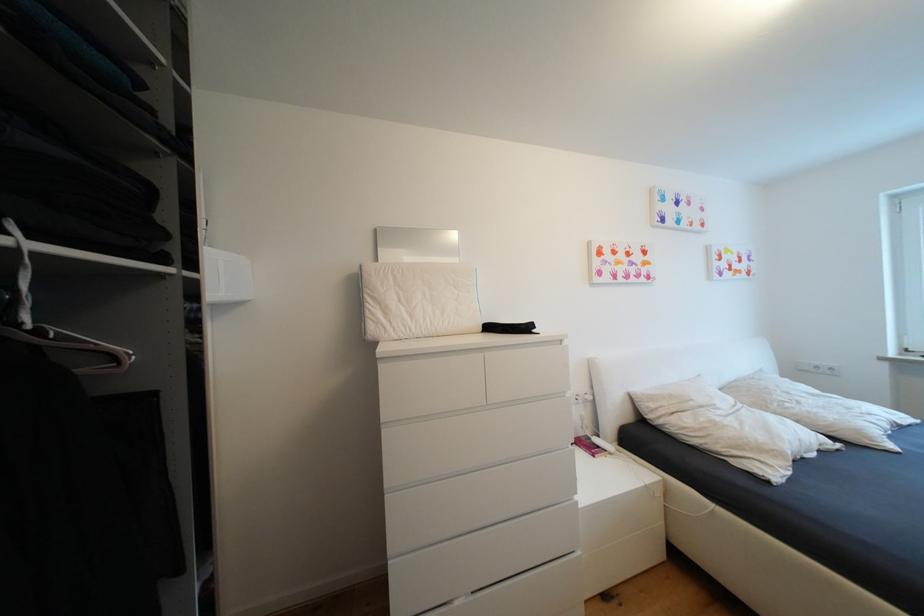
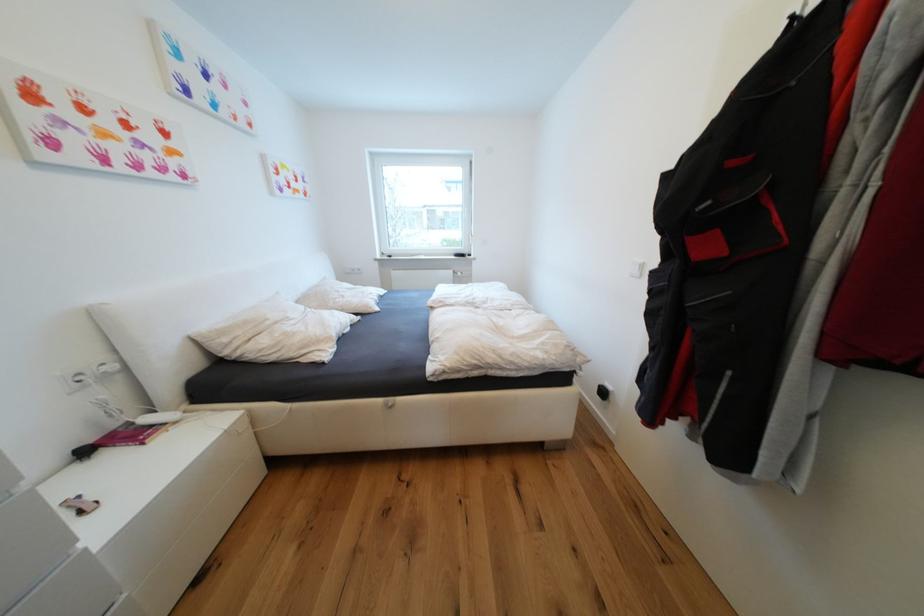
First-person continuous shooting, in which direction is the camera rotating?

The camera's rotation is toward right-down.